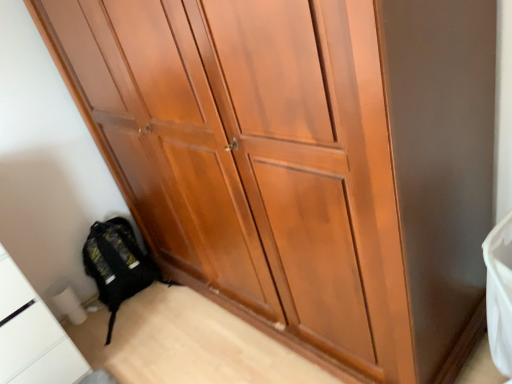
Question: Is white glossy cabinet at lower left not near black fabric backpack at lower left?

Choices:
 (A) no
 (B) yes

Answer: (A)

Question: From a real-world perspective, does white glossy cabinet at lower left stand above black fabric backpack at lower left?

Choices:
 (A) yes
 (B) no

Answer: (A)

Question: Considering the relative sizes of white glossy cabinet at lower left and black fabric backpack at lower left in the image provided, is white glossy cabinet at lower left bigger than black fabric backpack at lower left?

Choices:
 (A) yes
 (B) no

Answer: (A)

Question: Can you confirm if white glossy cabinet at lower left is positioned to the left of black fabric backpack at lower left?

Choices:
 (A) no
 (B) yes

Answer: (B)

Question: Does white glossy cabinet at lower left have a lesser width compared to black fabric backpack at lower left?

Choices:
 (A) yes
 (B) no

Answer: (B)

Question: From a real-world perspective, is white glossy cabinet at lower left under black fabric backpack at lower left?

Choices:
 (A) yes
 (B) no

Answer: (B)

Question: Could you tell me if black fabric backpack at lower left is turned towards white glossy cabinet at lower left?

Choices:
 (A) yes
 (B) no

Answer: (B)

Question: Is black fabric backpack at lower left not inside white glossy cabinet at lower left?

Choices:
 (A) no
 (B) yes

Answer: (B)

Question: Considering the relative sizes of black fabric backpack at lower left and white glossy cabinet at lower left in the image provided, is black fabric backpack at lower left bigger than white glossy cabinet at lower left?

Choices:
 (A) yes
 (B) no

Answer: (B)

Question: From the image's perspective, is black fabric backpack at lower left located beneath white glossy cabinet at lower left?

Choices:
 (A) yes
 (B) no

Answer: (B)

Question: Can you confirm if black fabric backpack at lower left is taller than white glossy cabinet at lower left?

Choices:
 (A) yes
 (B) no

Answer: (B)

Question: Can you confirm if black fabric backpack at lower left is thinner than white glossy cabinet at lower left?

Choices:
 (A) no
 (B) yes

Answer: (B)

Question: From the image's perspective, is white glossy cabinet at lower left located above or below black fabric backpack at lower left?

Choices:
 (A) below
 (B) above

Answer: (A)